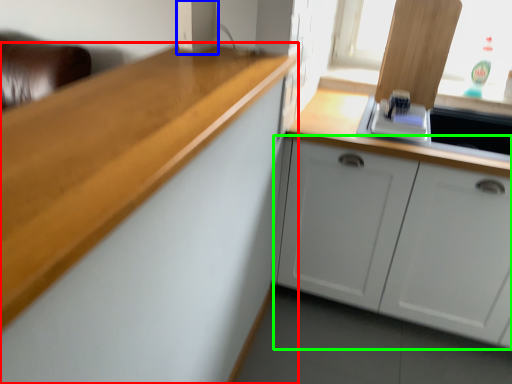
Question: Which object is positioned farthest from cabinetry (highlighted by a red box)? Select from appliance (highlighted by a blue box) and cabinetry (highlighted by a green box).

Choices:
 (A) appliance
 (B) cabinetry

Answer: (B)